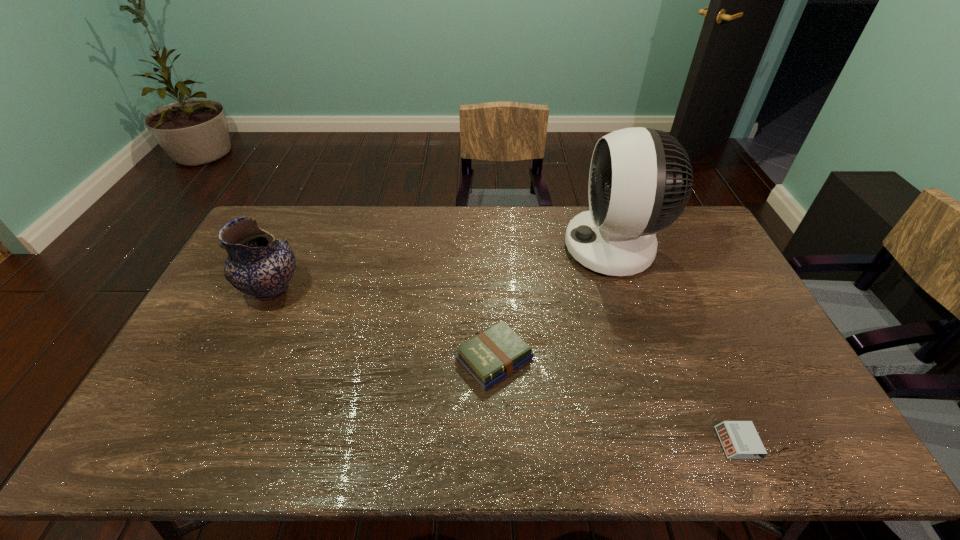
Locate an element on the screen. The image size is (960, 540). the closest object to the alarm clock is located at coordinates (495, 353).

You are a GUI agent. You are given a task and a screenshot of the screen. Output one action in this format:
    pyautogui.click(x=<x>, y=<y>)
    Task: Click on the vacant space that satisfies the following two spatial constraints: 1. on the grille of the nearest object; 2. on the left side of the fan
    
    Given the screenshot: What is the action you would take?
    pyautogui.click(x=679, y=443)

Identify the location of free space that satisfies the following two spatial constraints: 1. on the grille of the tallest object; 2. on the back side of the shortest object. Image resolution: width=960 pixels, height=540 pixels. (679, 443).

What are the coordinates of `vacant space that satisfies the following two spatial constraints: 1. on the grille of the tallest object; 2. on the front side of the second nearest object` in the screenshot? It's located at (651, 358).